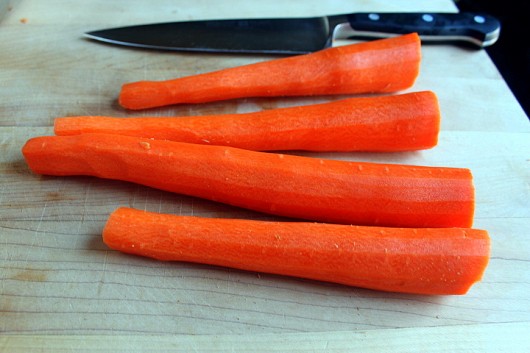
Find the location of a particular element. handle is located at coordinates (472, 42).